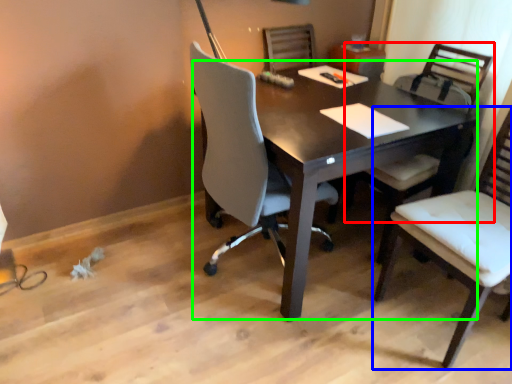
Question: Estimate the real-world distances between objects in this image. Which object is farther from chair (highlighted by a red box), chair (highlighted by a blue box) or desk (highlighted by a green box)?

Choices:
 (A) chair
 (B) desk

Answer: (A)